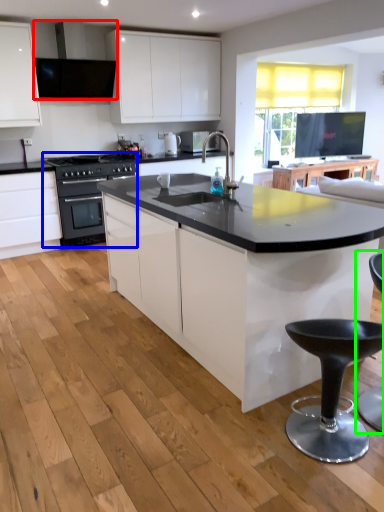
Question: Which object is the closest to the exhaust hood (highlighted by a red box)? Choose among these: kitchen appliance (highlighted by a blue box) or swivel chair (highlighted by a green box).

Choices:
 (A) kitchen appliance
 (B) swivel chair

Answer: (A)